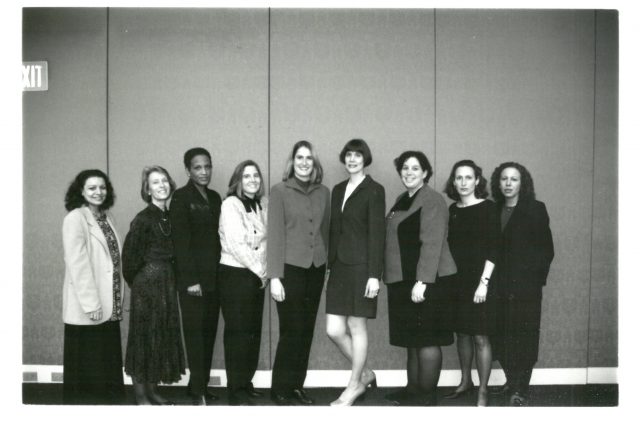
Where is `wall`? The width and height of the screenshot is (640, 421). wall is located at coordinates (571, 100).